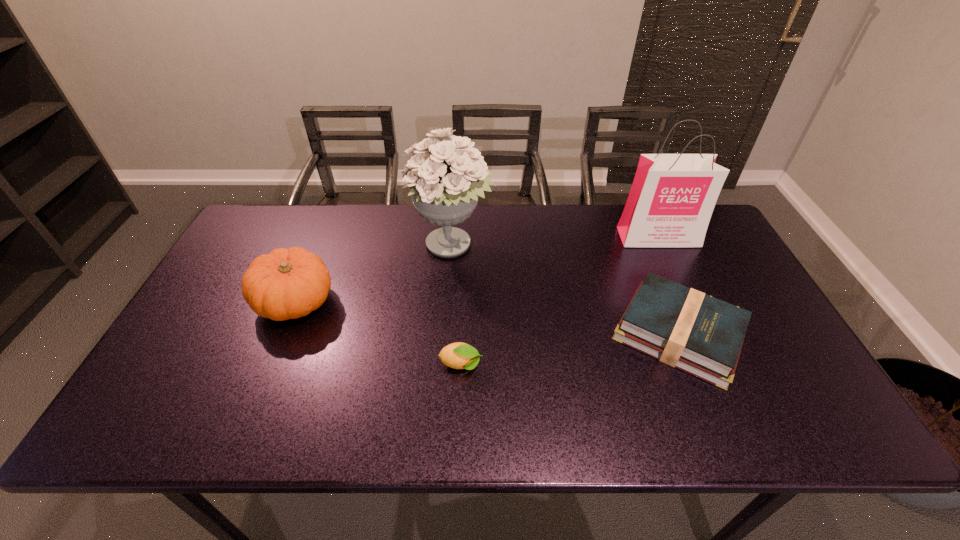
Where is `free space between the third shortest object and the shopping bag`? free space between the third shortest object and the shopping bag is located at coordinates (477, 269).

At what (x,y) coordinates should I click in order to perform the action: click on unoccupied area between the lemon and the bouquet. Please return your answer as a coordinate pair (x, y). Looking at the image, I should click on (457, 306).

Where is `empty space between the shopping bag and the leftmost object`? The height and width of the screenshot is (540, 960). empty space between the shopping bag and the leftmost object is located at coordinates (477, 269).

Choose which object is the nearest neighbor to the bouquet. Please provide its 2D coordinates. Your answer should be formatted as a tuple, i.e. [(x, y)], where the tuple contains the x and y coordinates of a point satisfying the conditions above.

[(290, 283)]

Choose which object is the nearest neighbor to the hardback book. Please provide its 2D coordinates. Your answer should be formatted as a tuple, i.e. [(x, y)], where the tuple contains the x and y coordinates of a point satisfying the conditions above.

[(672, 198)]

Where is `free location that satisfies the following two spatial constraints: 1. on the front side of the hardback book; 2. on the left side of the bouquet`? This screenshot has height=540, width=960. free location that satisfies the following two spatial constraints: 1. on the front side of the hardback book; 2. on the left side of the bouquet is located at coordinates (446, 334).

You are a GUI agent. You are given a task and a screenshot of the screen. Output one action in this format:
    pyautogui.click(x=<x>, y=<y>)
    Task: Click on the free point that satisfies the following two spatial constraints: 1. on the front side of the hardback book; 2. on the left side of the bouquet
    
    Given the screenshot: What is the action you would take?
    pyautogui.click(x=446, y=334)

Locate an element on the screen. This screenshot has height=540, width=960. vacant space that satisfies the following two spatial constraints: 1. on the front-facing side of the shopping bag; 2. with leaves positioned above the lemon is located at coordinates (717, 365).